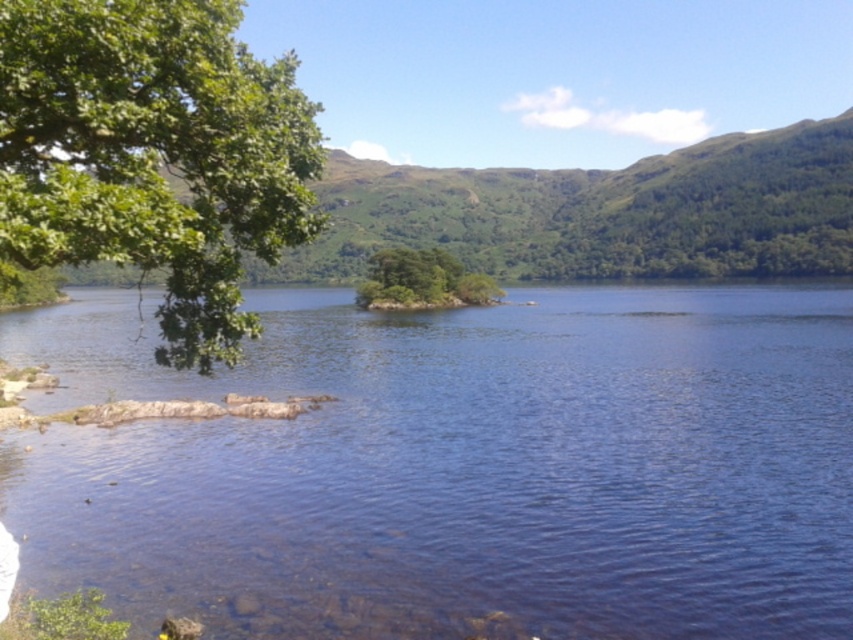
Does green leafy branch at upper left appear under green leafy island at center?

Yes.

Which is below, green leafy branch at upper left or green leafy island at center?

green leafy branch at upper left

Find the location of a particular element. green leafy branch at upper left is located at coordinates (154, 154).

This screenshot has height=640, width=853. What are the coordinates of `green leafy branch at upper left` in the screenshot? It's located at (154, 154).

Is clear blue water at center smaller than green leafy branch at upper left?

No, clear blue water at center is not smaller than green leafy branch at upper left.

Can you confirm if clear blue water at center is positioned below green leafy branch at upper left?

Yes.

Between point (515, 321) and point (10, 168), which one is positioned behind?

The point (515, 321) is behind.

Where is `clear blue water at center`? Image resolution: width=853 pixels, height=640 pixels. clear blue water at center is located at coordinates (460, 467).

Who is shorter, clear blue water at center or green leafy island at center?

clear blue water at center

Which is in front, point (718, 634) or point (393, 266)?

Point (718, 634) is more forward.

What are the coordinates of `clear blue water at center` in the screenshot? It's located at (460, 467).